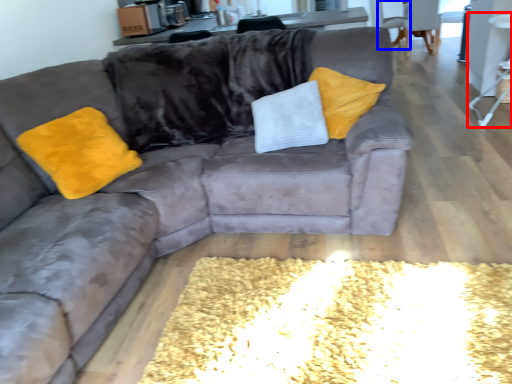
Question: Which object is further to the camera taking this photo, side table (highlighted by a red box) or armchair (highlighted by a blue box)?

Choices:
 (A) side table
 (B) armchair

Answer: (B)